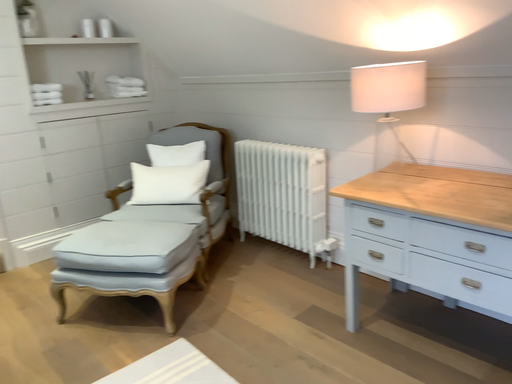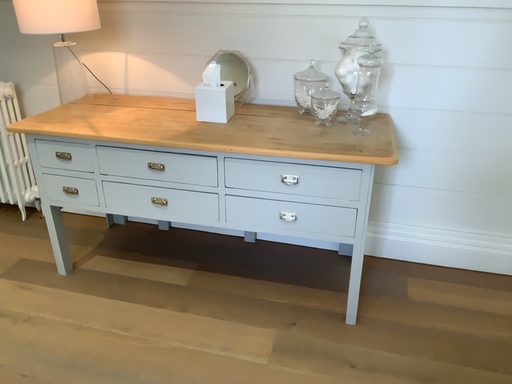
Question: How did the camera likely rotate when shooting the video?

Choices:
 (A) rotated right
 (B) rotated left

Answer: (A)